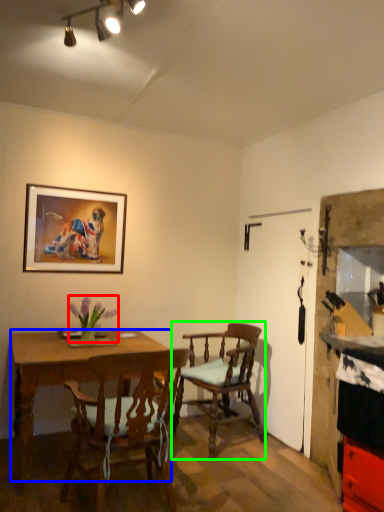
Question: Considering the real-world distances, which object is closest to flower (highlighted by a red box)? desk (highlighted by a blue box) or chair (highlighted by a green box).

Choices:
 (A) desk
 (B) chair

Answer: (A)